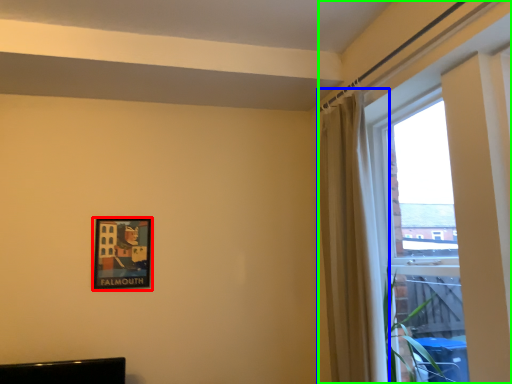
Question: Which object is the farthest from picture frame (highlighted by a red box)? Choose among these: curtain (highlighted by a blue box) or window (highlighted by a green box).

Choices:
 (A) curtain
 (B) window

Answer: (B)